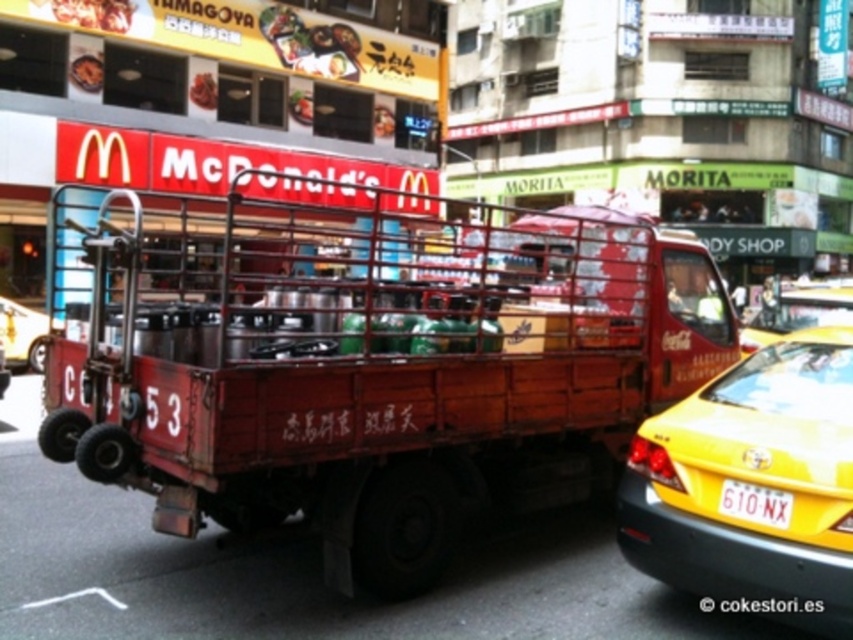
Question: Can you confirm if rusty metal truck at center is positioned to the left of metallic silver car at left?

Choices:
 (A) no
 (B) yes

Answer: (A)

Question: Which of these objects is positioned closest to the yellow matte taxi at right?

Choices:
 (A) yellow plastic license plate at lower right
 (B) rusty metal truck at center
 (C) metallic silver car at left

Answer: (A)

Question: Is metallic silver car at left wider than yellow plastic license plate at lower right?

Choices:
 (A) yes
 (B) no

Answer: (A)

Question: Observing the image, what is the correct spatial positioning of yellow matte taxi at right in reference to yellow plastic license plate at lower right?

Choices:
 (A) right
 (B) left

Answer: (A)

Question: Which of the following is the closest to the observer?

Choices:
 (A) (656, 323)
 (B) (22, 353)

Answer: (A)

Question: Which of the following is the farthest from the observer?

Choices:
 (A) (747, 513)
 (B) (30, 330)
 (C) (653, 516)
 (D) (320, 490)

Answer: (B)